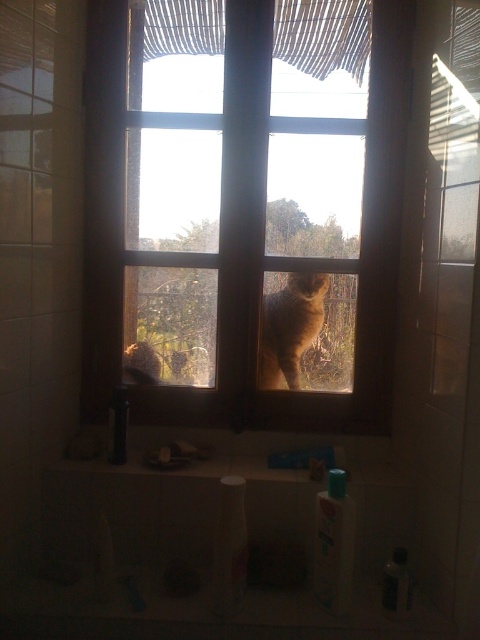
You are standing in the room depicted in the scene. There is a wooden frame at center located at point (242, 209). If you want to place a small plant on the windowsill, where should you place it so that it is directly in front of the wooden frame at center?

The wooden frame at center is located at point (242, 209), so placing the small plant at that coordinate on the windowsill would position it directly in front of the wooden frame at center.

You are a photographer trying to capture a clear shot of both the wooden frame at center and the fuzzy brown cat at center through the window. Since the window is slightly dirty, you need to focus on the closest object to ensure the other is still in focus. Which object should you focus on?

The wooden frame at center is taller than the fuzzy brown cat at center, so focusing on the wooden frame at center will keep both objects in focus as it is larger.